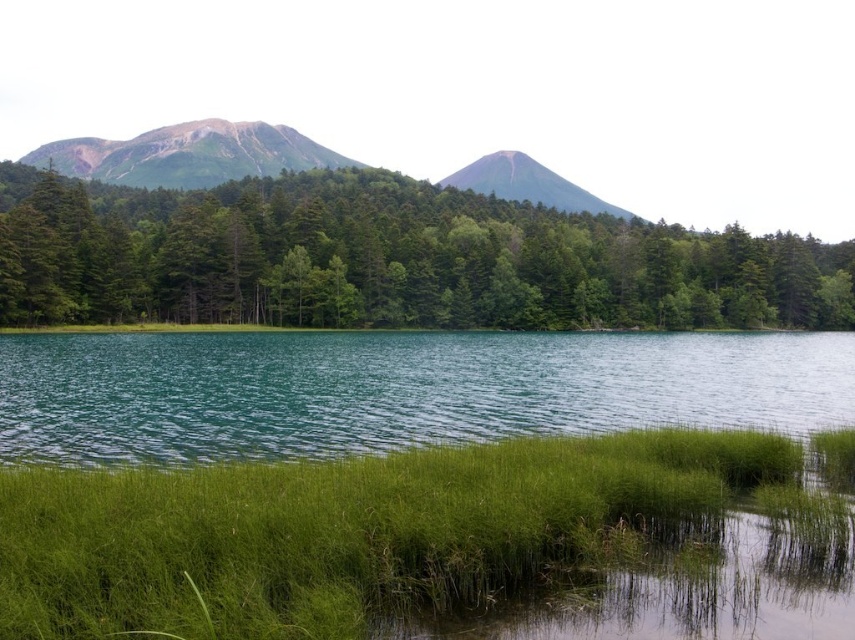
You are a bird soaring above the serene natural landscape. You spot the green matte tree at center and the teal glossy water at center. Which object would you see first if you were flying downward from above?

The green matte tree at center is much taller than the teal glossy water at center, so you would see the green matte tree at center first as you fly downward from above.

You are standing at the edge of the lake and want to take a photo of both the point at coordinates (171, 182) and the point at (588, 193). Which point will appear larger in your camera view?

The point at coordinates (171, 182) will appear larger in the camera view because it is closer to the camera than point at coordinates (588, 193).

You are standing at the center of the image and want to walk towards the green matte tree at center. In which direction should you move?

The green matte tree at center is already at the center of the image, so you are already facing it directly.